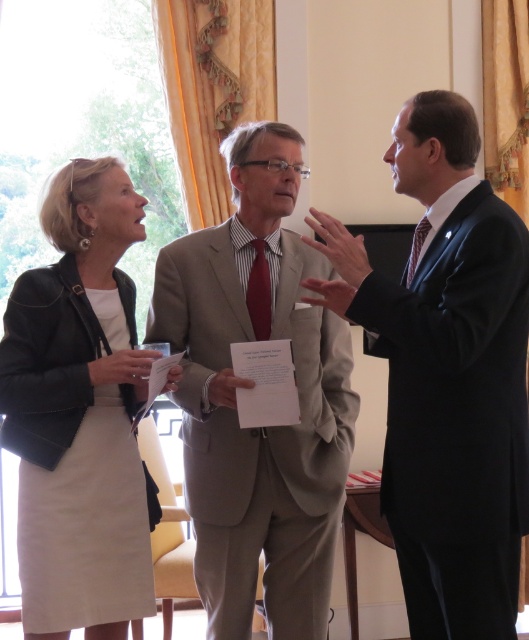
Is point (280, 588) positioned after point (95, 452)?

Yes.

Is point (254, 291) positioned behind point (57, 227)?

Yes, it is.

Locate an element on the screen. The width and height of the screenshot is (529, 640). light beige suit at center is located at coordinates (250, 387).

Can you confirm if dark blue suit at right is wider than leather jacket at left?

Yes.

Who is taller, dark blue suit at right or leather jacket at left?

Standing taller between the two is dark blue suit at right.

Locate an element on the screen. Image resolution: width=529 pixels, height=640 pixels. dark blue suit at right is located at coordinates (446, 374).

Is dark blue suit at right further to the viewer compared to light beige suit at center?

No, dark blue suit at right is closer to the viewer.

Between point (428, 538) and point (267, 512), which one is positioned behind?

The point (267, 512) is behind.

Measure the distance between dark blue suit at right and camera.

dark blue suit at right is 1.92 meters from camera.

Image resolution: width=529 pixels, height=640 pixels. Find the location of `dark blue suit at right`. dark blue suit at right is located at coordinates (446, 374).